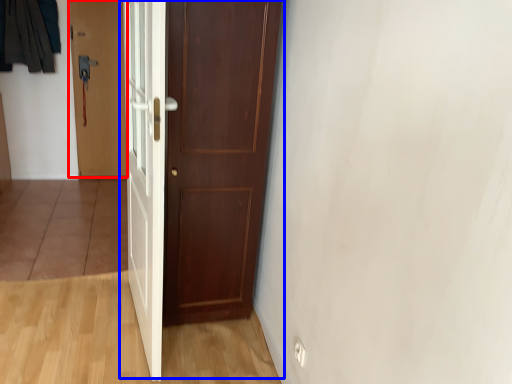
Question: Which point is further to the camera, door (highlighted by a red box) or door (highlighted by a blue box)?

Choices:
 (A) door
 (B) door

Answer: (A)